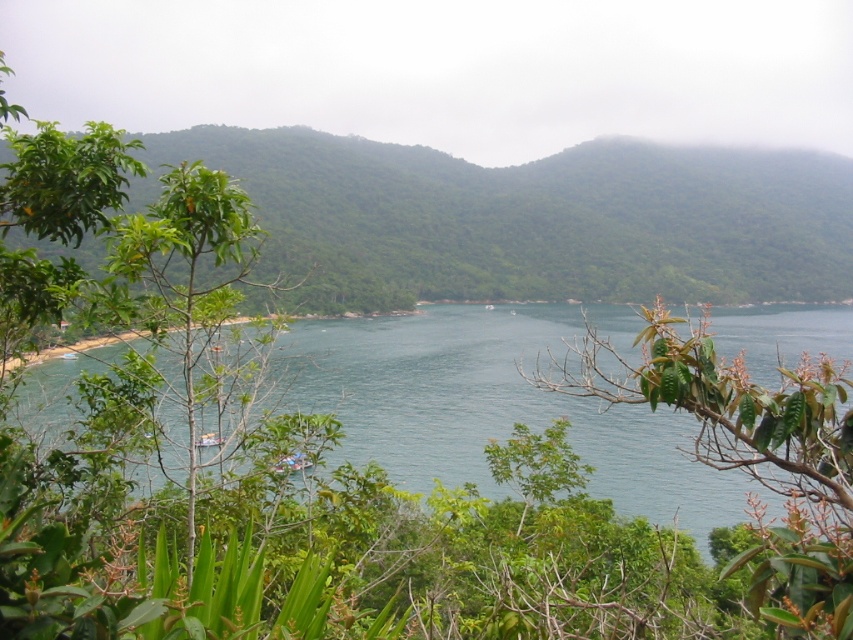
Is the position of clear blue water at center less distant than that of green leafy branch at center?

No, it is not.

Between point (685, 518) and point (819, 621), which one is positioned behind?

Positioned behind is point (685, 518).

Where is `clear blue water at center`? The width and height of the screenshot is (853, 640). clear blue water at center is located at coordinates (490, 406).

Between point (480, 186) and point (676, 413), which one is positioned in front?

Point (676, 413)

How much distance is there between green leafy forest at center and clear blue water at center?

green leafy forest at center and clear blue water at center are 29.05 feet apart from each other.

Is point (694, 288) behind point (432, 403)?

Yes, point (694, 288) is behind point (432, 403).

Find the location of a particular element. This screenshot has height=640, width=853. green leafy forest at center is located at coordinates (532, 220).

Which is below, green leafy forest at center or green leafy branch at center?

green leafy branch at center

Which is behind, point (303, 147) or point (747, 593)?

The point (303, 147) is behind.

Where is `green leafy forest at center`? The image size is (853, 640). green leafy forest at center is located at coordinates (532, 220).